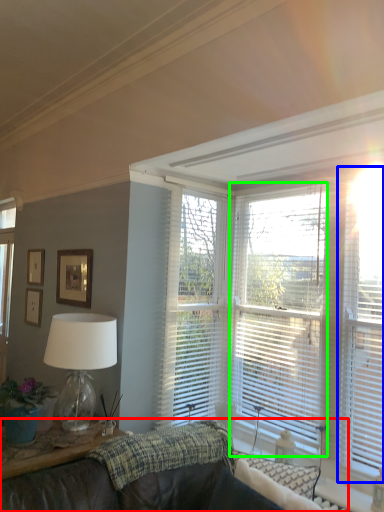
Question: Considering the real-world distances, which object is farthest from studio couch (highlighted by a red box)? blind (highlighted by a blue box) or window blind (highlighted by a green box)?

Choices:
 (A) blind
 (B) window blind

Answer: (A)